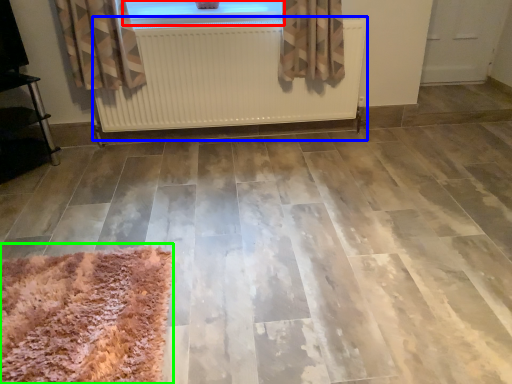
Question: Based on their relative distances, which object is farther from window (highlighted by a red box)? Choose from radiator (highlighted by a blue box) and mat (highlighted by a green box).

Choices:
 (A) radiator
 (B) mat

Answer: (B)